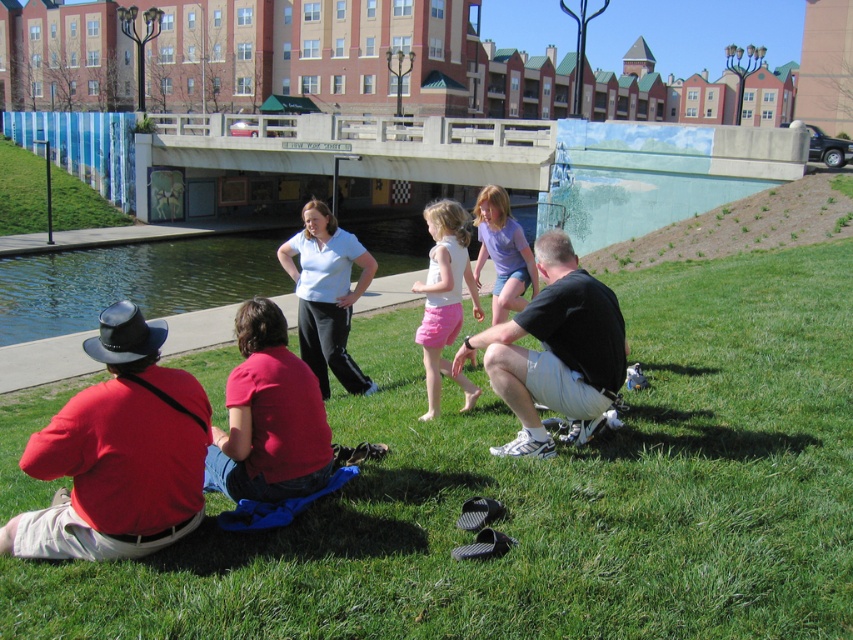
Which is in front, point (345, 522) or point (566, 332)?

Positioned in front is point (345, 522).

This screenshot has width=853, height=640. Find the location of `green grass at lower center`. green grass at lower center is located at coordinates (546, 493).

Does point (763, 625) lie behind point (512, 394)?

No.

Where is `green grass at lower center`? green grass at lower center is located at coordinates (546, 493).

Which is in front, point (83, 388) or point (318, 372)?

Point (83, 388) is in front.

Between matte red shirt at lower left and matte white shirt at center, which one appears on the right side from the viewer's perspective?

Positioned to the right is matte white shirt at center.

Who is more forward, (x=91, y=477) or (x=286, y=253)?

Point (x=91, y=477) is more forward.

What are the coordinates of `matte red shirt at lower left` in the screenshot? It's located at (119, 452).

Can you confirm if matte red shirt at lower left is bigger than black cotton shirt at lower right?

Actually, matte red shirt at lower left might be smaller than black cotton shirt at lower right.

Is point (86, 522) less distant than point (570, 365)?

Yes, point (86, 522) is closer to viewer.

Find the location of a particular element. matte red shirt at lower left is located at coordinates (119, 452).

Find the location of `matte red shirt at lower left`. matte red shirt at lower left is located at coordinates (119, 452).